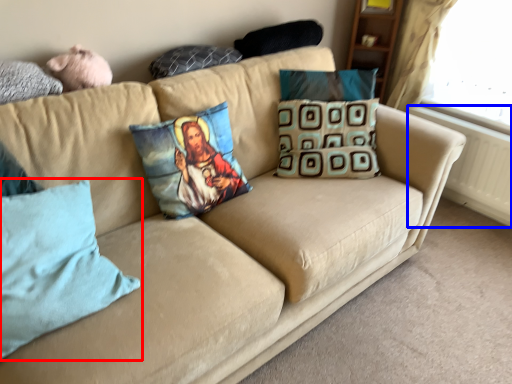
Question: Which point is further to the camera, pillow (highlighted by a red box) or radiator (highlighted by a blue box)?

Choices:
 (A) pillow
 (B) radiator

Answer: (B)